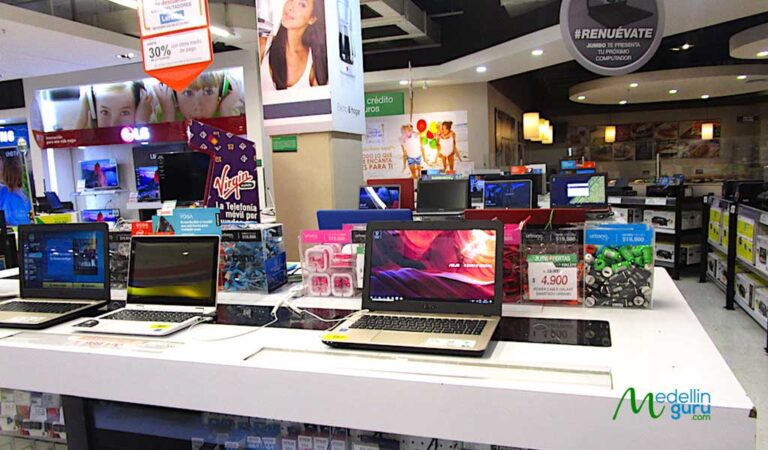
Where is `laptop`? Image resolution: width=768 pixels, height=450 pixels. laptop is located at coordinates (584, 185).